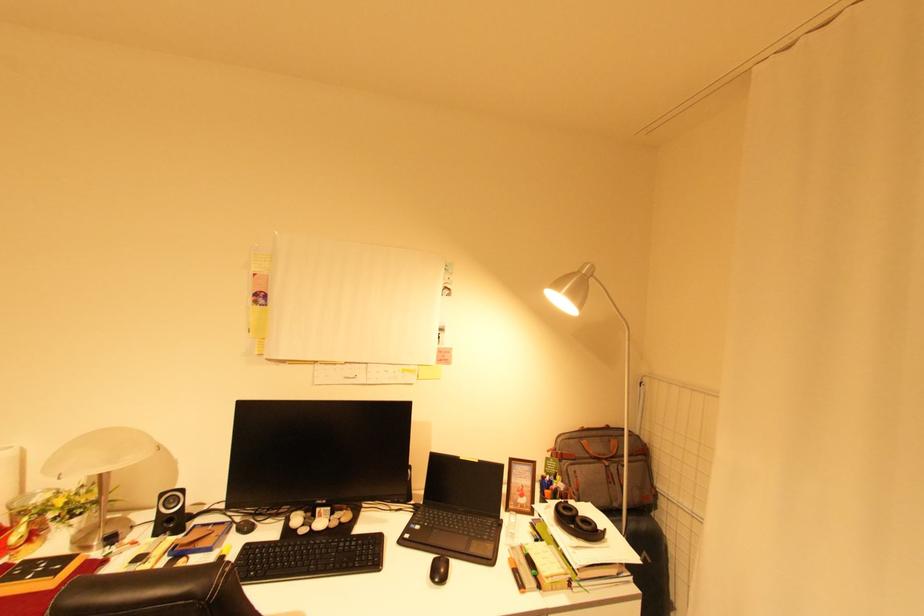
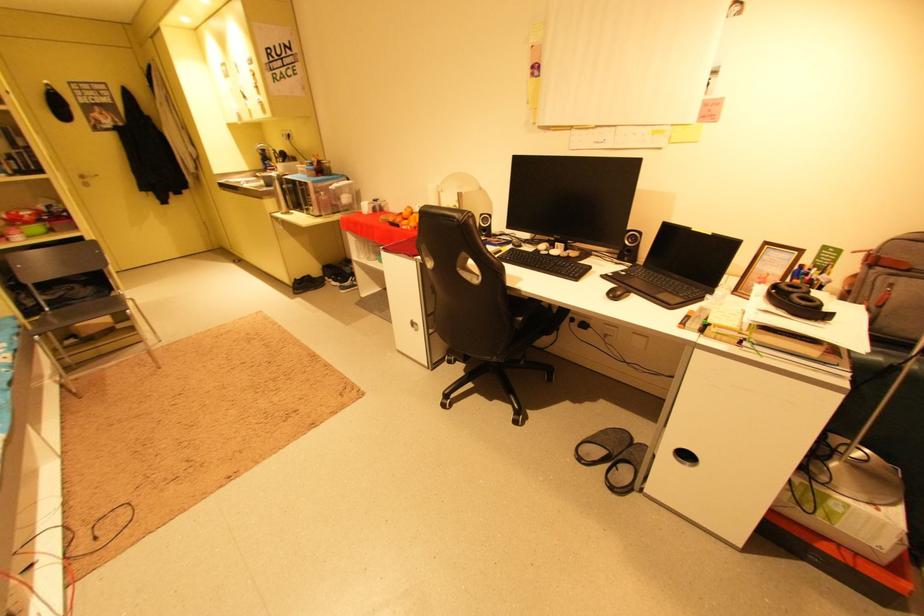
Find the pixel in the second image that matches the point at 450,570 in the first image.

(627, 294)